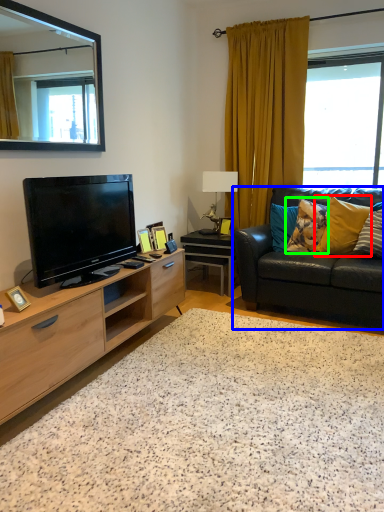
Question: Which is farther away from pillow (highlighted by a red box)? studio couch (highlighted by a blue box) or pillow (highlighted by a green box)?

Choices:
 (A) studio couch
 (B) pillow

Answer: (A)